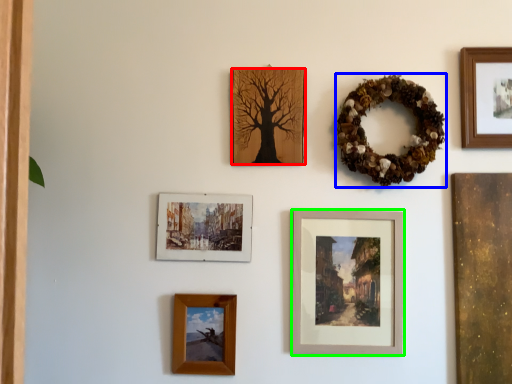
Question: Which object is positioned farthest from picture frame (highlighted by a red box)? Select from decor (highlighted by a blue box) and picture frame (highlighted by a green box).

Choices:
 (A) decor
 (B) picture frame

Answer: (B)